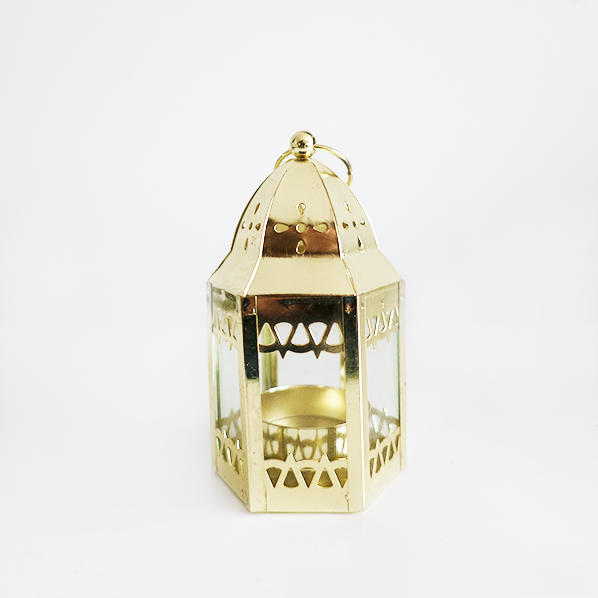
Locate an element on the screen. cup is located at coordinates (288, 410).